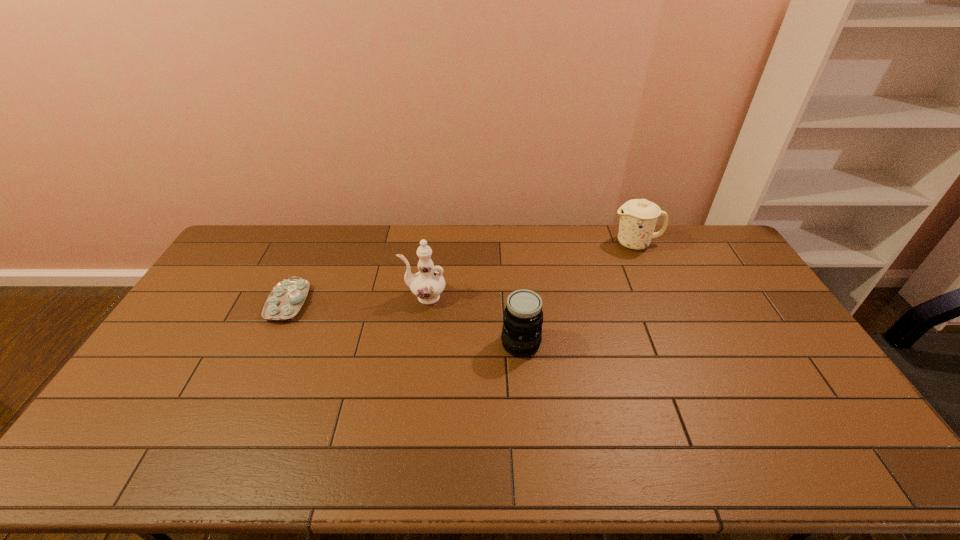
Identify the location of vacant point at the right edge. (737, 282).

You are a GUI agent. You are given a task and a screenshot of the screen. Output one action in this format:
    pyautogui.click(x=<x>, y=<y>)
    Task: Click on the free location at the far right corner
    
    Given the screenshot: What is the action you would take?
    pyautogui.click(x=720, y=244)

Where is `vacant space that's between the nearest object and the leftmost object`? vacant space that's between the nearest object and the leftmost object is located at coordinates (404, 323).

Where is `empty space between the leftmost object and the tallest object`? Image resolution: width=960 pixels, height=540 pixels. empty space between the leftmost object and the tallest object is located at coordinates (356, 300).

Image resolution: width=960 pixels, height=540 pixels. Identify the location of unoccupied position between the telephoto lens and the farthest chinaware. (578, 294).

What are the coordinates of `vacant space that's between the second object from right to left and the rightmost object` in the screenshot? It's located at (578, 294).

Locate an element on the screen. The image size is (960, 540). vacant space in between the telephoto lens and the second object from left to right is located at coordinates (472, 320).

Locate an element on the screen. vacant space that's between the leftmost chinaware and the nearest object is located at coordinates (404, 323).

Where is `unoccupied position between the shortest chinaware and the second chinaware from left to right`? unoccupied position between the shortest chinaware and the second chinaware from left to right is located at coordinates (356, 300).

Where is `vacant space that is in between the leftmost chinaware and the tallest object`? This screenshot has width=960, height=540. vacant space that is in between the leftmost chinaware and the tallest object is located at coordinates (356, 300).